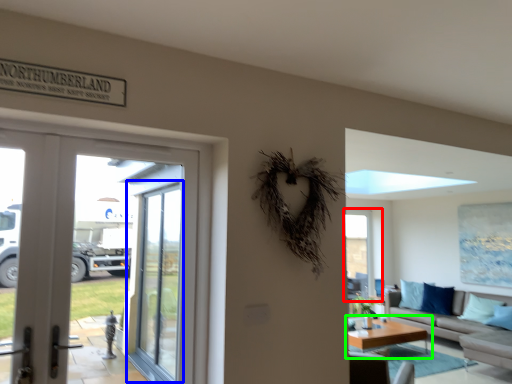
Question: Which is farther away from window (highlighted by a red box)? screen door (highlighted by a blue box) or coffee table (highlighted by a green box)?

Choices:
 (A) screen door
 (B) coffee table

Answer: (A)